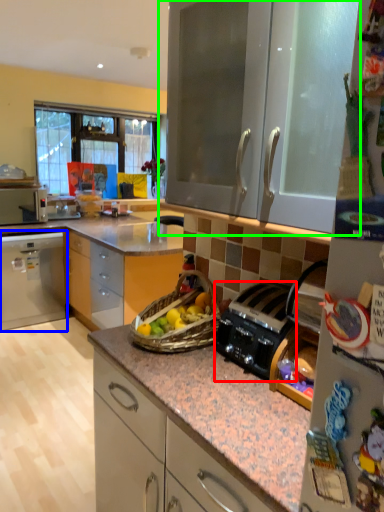
Question: Which object is the farthest from kitchen appliance (highlighted by a red box)? Choose among these: cabinetry (highlighted by a blue box) or cabinetry (highlighted by a green box).

Choices:
 (A) cabinetry
 (B) cabinetry

Answer: (A)